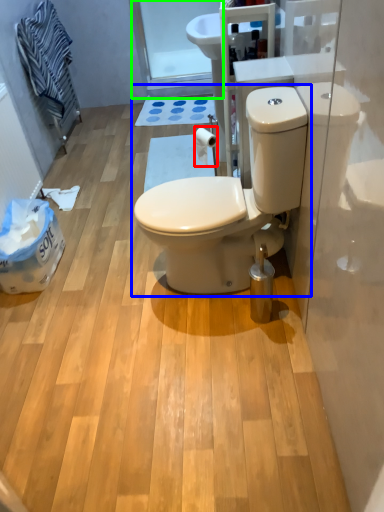
Question: Which is nearer to the toilet paper (highlighted by a red box)? toilet (highlighted by a blue box) or glass door (highlighted by a green box).

Choices:
 (A) toilet
 (B) glass door

Answer: (A)